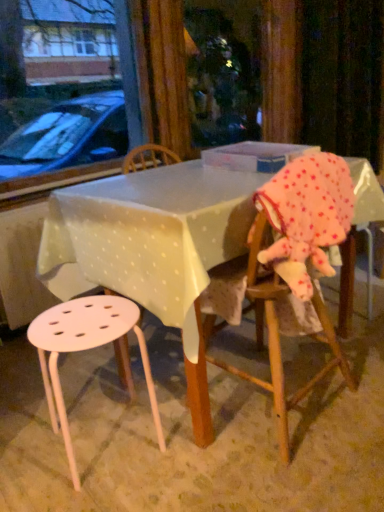
Identify the location of free space to the back side of wooden chair at right. (245, 347).